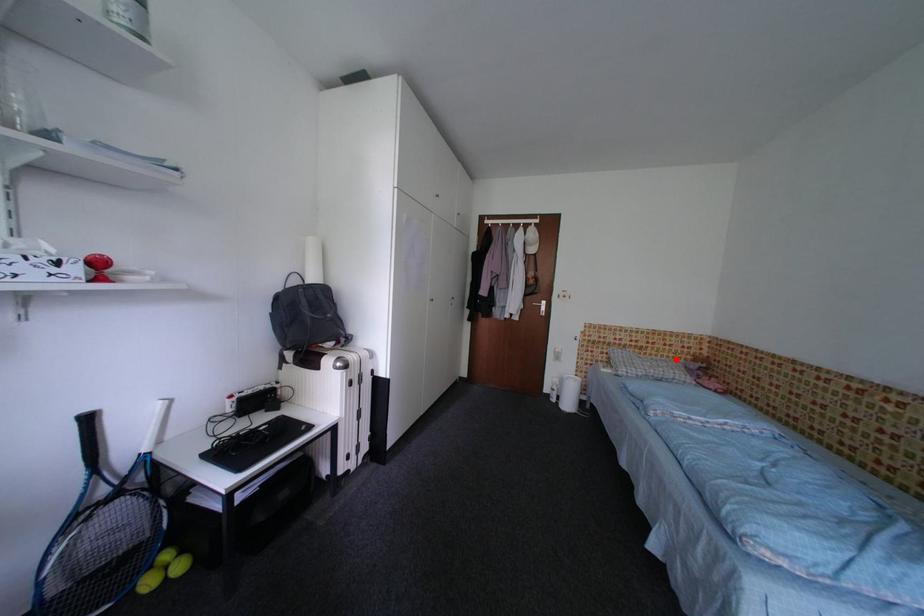
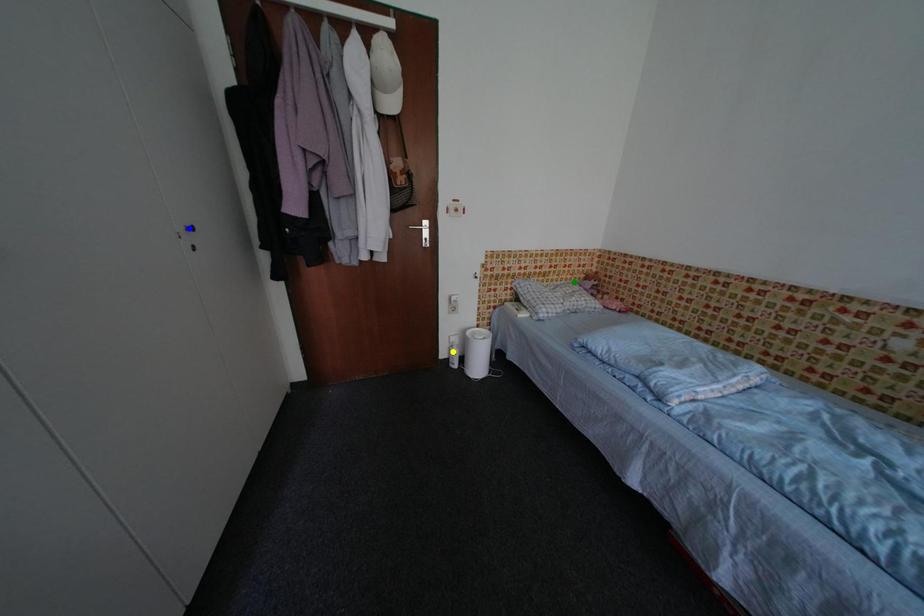
Question: I am providing you with two images of the same scene from different viewpoints. A red point is marked on the first image. You are given multiple points on the second image. Which spot in image 2 lines up with the point in image 1?

Choices:
 (A) green point
 (B) yellow point
 (C) blue point

Answer: (A)